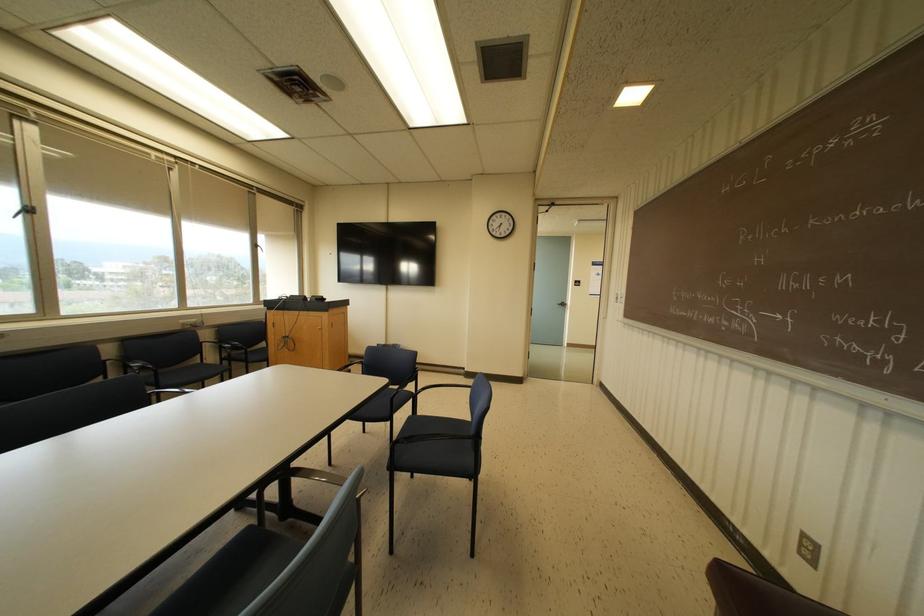
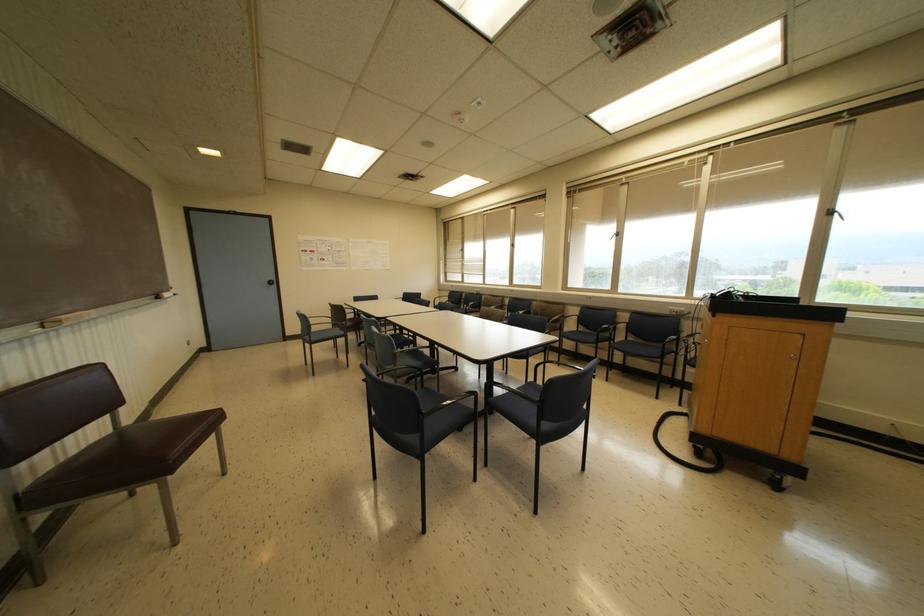
Find the pixel in the second image that matches point (30, 209) in the first image.

(617, 233)